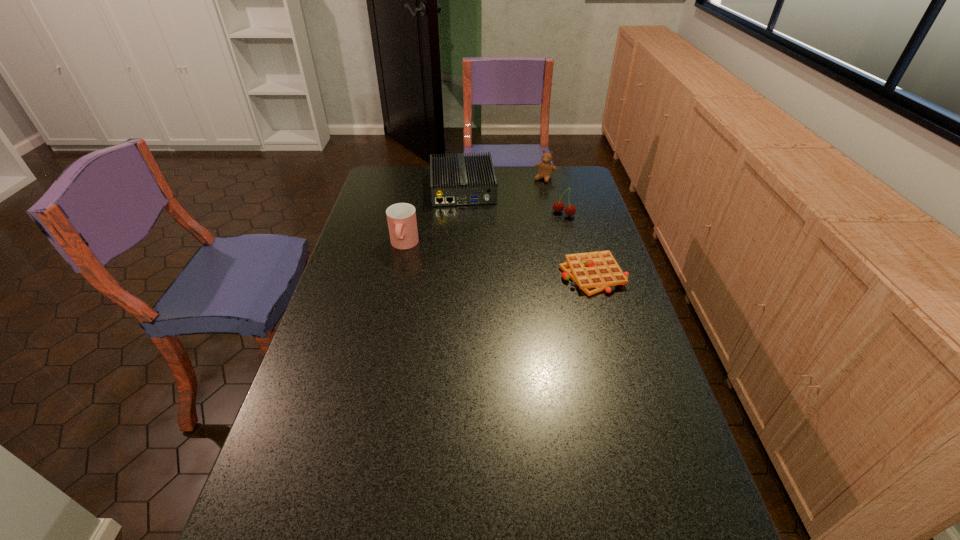
At what (x,y) coordinates should I click in order to perform the action: click on free location located on the face of the teddy bear. Please return your answer as a coordinate pair (x, y). The image size is (960, 540). Looking at the image, I should click on (530, 198).

The image size is (960, 540). Find the location of `vacant space located on the back panel of the second object from left to right`. vacant space located on the back panel of the second object from left to right is located at coordinates click(471, 268).

Identify the location of vacant space located on the back panel of the second object from left to right. (468, 241).

Identify the location of free point located on the back panel of the second object from left to right. The height and width of the screenshot is (540, 960). (467, 222).

Where is `vacant point located 0.380m on the surface of the cherry`? vacant point located 0.380m on the surface of the cherry is located at coordinates (497, 268).

Where is `vacant area situated 0.360m on the surface of the cherry`? Image resolution: width=960 pixels, height=540 pixels. vacant area situated 0.360m on the surface of the cherry is located at coordinates (501, 265).

The height and width of the screenshot is (540, 960). I want to click on free region located 0.380m on the surface of the cherry, so click(497, 268).

Where is `teddy bear that is at the far edge`? The height and width of the screenshot is (540, 960). teddy bear that is at the far edge is located at coordinates (x=546, y=168).

The height and width of the screenshot is (540, 960). In order to click on router that is positioned at the far edge in this screenshot , I will do 461,180.

Identify the location of object at the left edge. This screenshot has height=540, width=960. (401, 217).